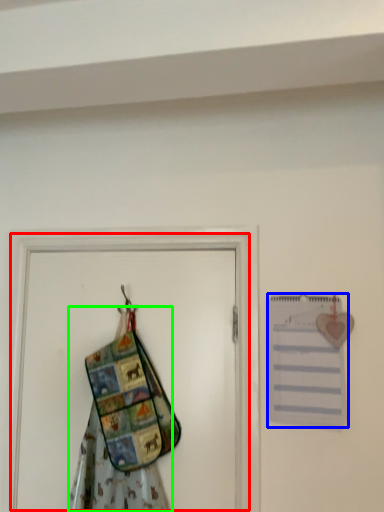
Question: Estimate the real-world distances between objects in this image. Which object is closer to screen door (highlighted by a red box), journal (highlighted by a blue box) or fancy dress (highlighted by a green box)?

Choices:
 (A) journal
 (B) fancy dress

Answer: (A)